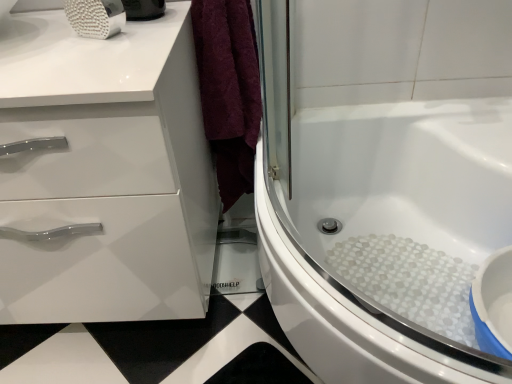
Question: Is white glossy cabinet at left facing towards white textured bath at center?

Choices:
 (A) yes
 (B) no

Answer: (B)

Question: Is white glossy cabinet at left at the left side of white textured bath at center?

Choices:
 (A) no
 (B) yes

Answer: (B)

Question: Considering the relative sizes of white glossy cabinet at left and white textured bath at center in the image provided, is white glossy cabinet at left smaller than white textured bath at center?

Choices:
 (A) no
 (B) yes

Answer: (B)

Question: Is white glossy cabinet at left shorter than white textured bath at center?

Choices:
 (A) yes
 (B) no

Answer: (B)

Question: Does white glossy cabinet at left have a greater width compared to white textured bath at center?

Choices:
 (A) yes
 (B) no

Answer: (B)

Question: Considering the relative positions of white glossy cabinet at left and white textured bath at center in the image provided, is white glossy cabinet at left to the right of white textured bath at center from the viewer's perspective?

Choices:
 (A) yes
 (B) no

Answer: (B)

Question: Considering the relative positions of white textured bath at center and white glossy cabinet at left in the image provided, is white textured bath at center to the right of white glossy cabinet at left from the viewer's perspective?

Choices:
 (A) yes
 (B) no

Answer: (A)

Question: Does white textured bath at center come behind white glossy cabinet at left?

Choices:
 (A) no
 (B) yes

Answer: (A)

Question: From the image's perspective, would you say white textured bath at center is shown under white glossy cabinet at left?

Choices:
 (A) no
 (B) yes

Answer: (B)

Question: From the image's perspective, is white textured bath at center over white glossy cabinet at left?

Choices:
 (A) yes
 (B) no

Answer: (B)

Question: Is white textured bath at center at the left side of white glossy cabinet at left?

Choices:
 (A) no
 (B) yes

Answer: (A)

Question: Does white textured bath at center have a greater height compared to white glossy cabinet at left?

Choices:
 (A) no
 (B) yes

Answer: (A)

Question: Is point (366, 284) positioned closer to the camera than point (99, 258)?

Choices:
 (A) farther
 (B) closer

Answer: (A)